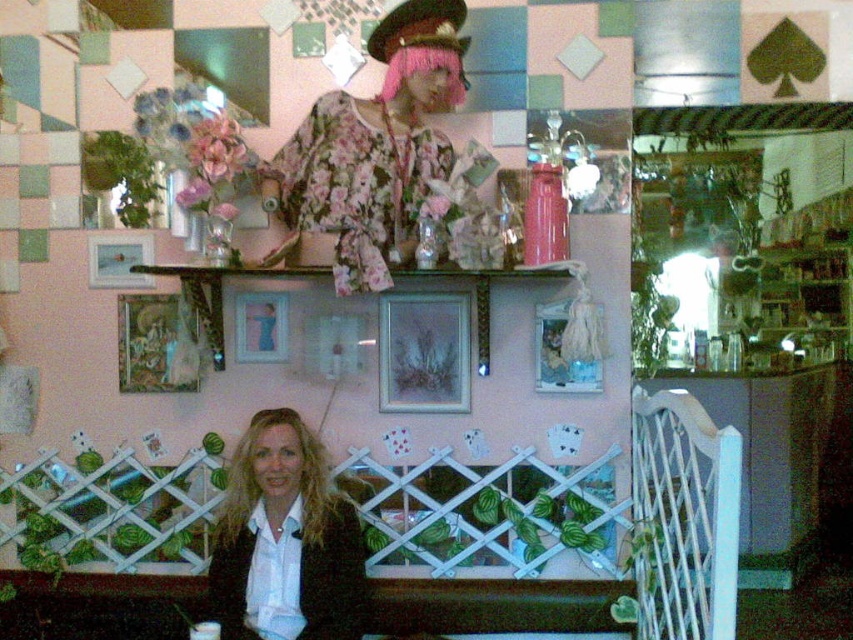
Question: Which is nearer to the metallic silver frame at center?

Choices:
 (A) matte silver picture frame at upper center
 (B) metallic silver picture frame at center

Answer: (B)

Question: Among these points, which one is nearest to the camera?

Choices:
 (A) (177, 326)
 (B) (134, 275)

Answer: (A)

Question: Does floral fabric kimono at upper center have a smaller size compared to metallic silver frame at center?

Choices:
 (A) yes
 (B) no

Answer: (B)

Question: Does metallic silver frame at center appear on the left side of metallic silver picture frame at center?

Choices:
 (A) no
 (B) yes

Answer: (B)

Question: Which point is closer to the camera?

Choices:
 (A) (316, 467)
 (B) (433, 390)
 (C) (548, 384)

Answer: (A)

Question: Does gold-framed painting at center appear under matte silver picture frame at upper center?

Choices:
 (A) yes
 (B) no

Answer: (A)